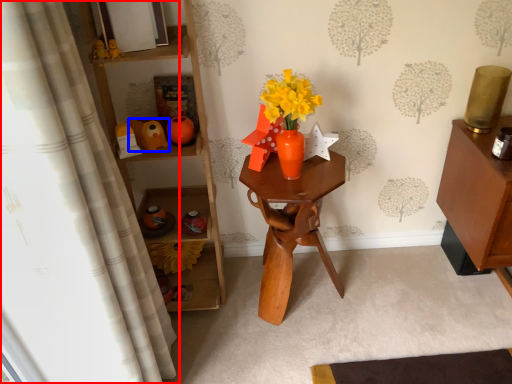
Question: Which object appears farthest to the camera in this image, curtain (highlighted by a red box) or toy (highlighted by a blue box)?

Choices:
 (A) curtain
 (B) toy

Answer: (B)